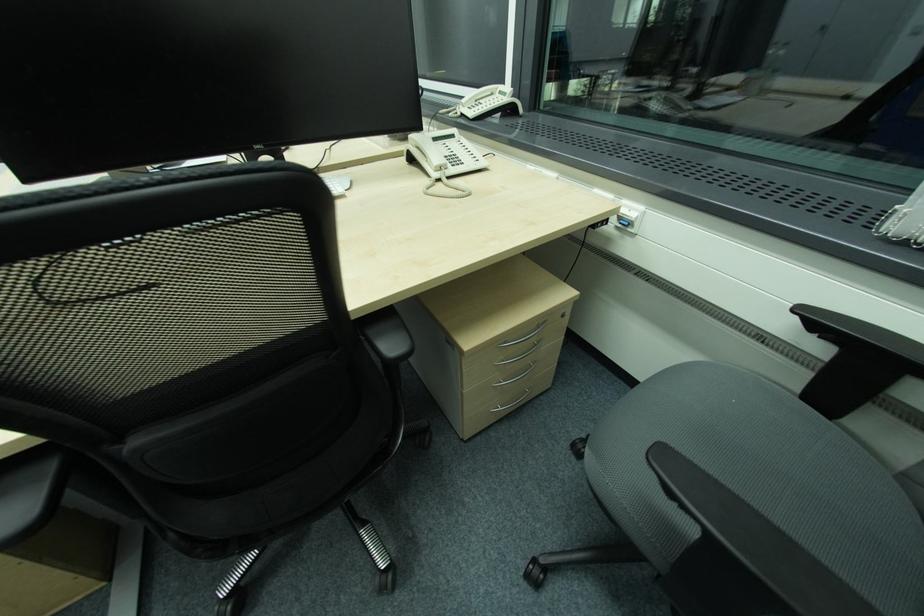
Locate an element on the screen. The height and width of the screenshot is (616, 924). black chair sitting surface is located at coordinates (769, 477).